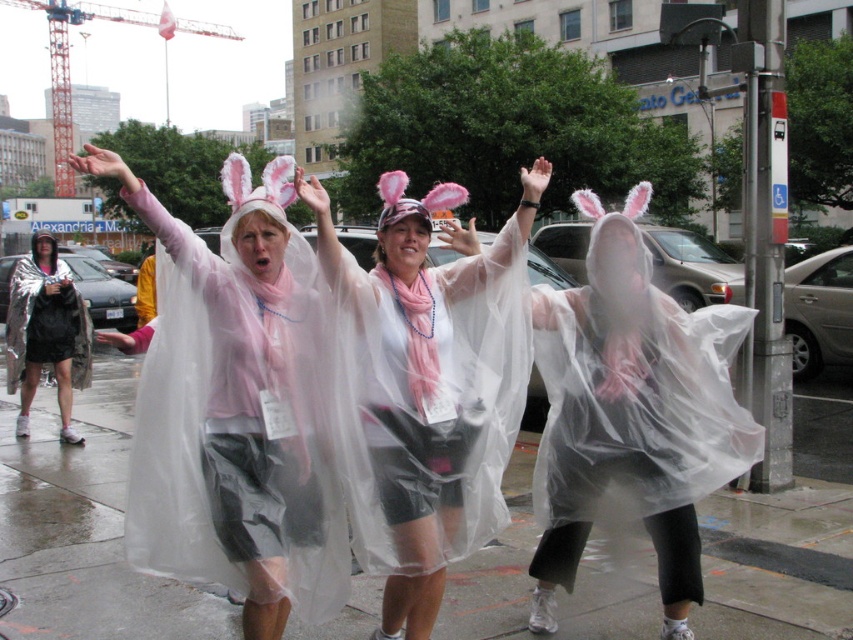
Question: Among these objects, which one is farthest from the camera?

Choices:
 (A) metallic silver poncho at left
 (B) matte pink scarf at center
 (C) transparent plastic raincoat at center

Answer: (A)

Question: Where is transparent plastic rain poncho at lower center located in relation to metallic silver poncho at left in the image?

Choices:
 (A) below
 (B) above

Answer: (A)

Question: Can you confirm if matte pink scarf at center is positioned below transparent plastic rain poncho at lower center?

Choices:
 (A) yes
 (B) no

Answer: (B)

Question: Which point is closer to the camera?

Choices:
 (A) translucent plastic poncho at center
 (B) transparent plastic rain poncho at lower center

Answer: (A)

Question: Which of the following is the closest to the observer?

Choices:
 (A) (74, 339)
 (B) (450, 545)
 (C) (274, 344)

Answer: (C)

Question: Is translucent plastic poncho at center positioned in front of transparent plastic raincoat at center?

Choices:
 (A) no
 (B) yes

Answer: (B)